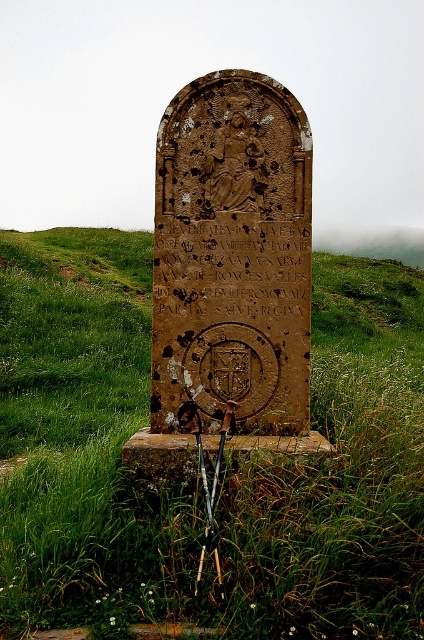
Describe the element at coordinates (83, 440) in the screenshot. The width and height of the screenshot is (424, 640). I see `green grassy at center` at that location.

Between point (39, 275) and point (245, 168), which one is positioned behind?

Positioned behind is point (39, 275).

Where is `green grassy at center`? Image resolution: width=424 pixels, height=640 pixels. green grassy at center is located at coordinates (83, 440).

Consider the image. Is green grassy at center bigger than brown stone inscription at center?

Indeed, green grassy at center has a larger size compared to brown stone inscription at center.

Does green grassy at center appear on the left side of brown stone inscription at center?

Correct, you'll find green grassy at center to the left of brown stone inscription at center.

The width and height of the screenshot is (424, 640). Identify the location of green grassy at center. (83, 440).

The height and width of the screenshot is (640, 424). I want to click on green grassy at center, so click(83, 440).

Can you confirm if brown stone plaque at center is smaller than brown stone inscription at center?

Incorrect, brown stone plaque at center is not smaller in size than brown stone inscription at center.

I want to click on brown stone plaque at center, so click(231, 256).

You are a GUI agent. You are given a task and a screenshot of the screen. Output one action in this format:
    pyautogui.click(x=<x>, y=<y>)
    Task: Click on the brown stone plaque at center
    The image size is (424, 640).
    Given the screenshot: What is the action you would take?
    pyautogui.click(x=231, y=256)

The height and width of the screenshot is (640, 424). I want to click on brown stone plaque at center, so click(231, 256).